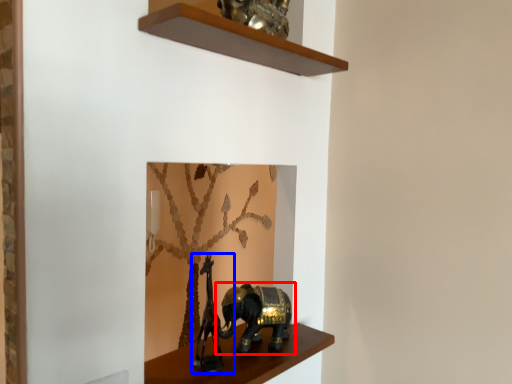
Question: Which object appears closest to the camera in this image, elephant (highlighted by a red box) or animal sculpture (highlighted by a blue box)?

Choices:
 (A) elephant
 (B) animal sculpture

Answer: (B)